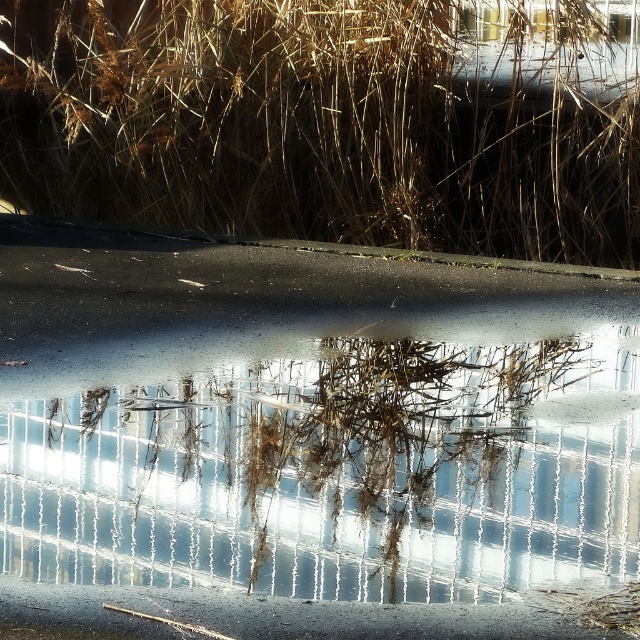
Question: Among these objects, which one is farthest from the camera?

Choices:
 (A) brown grass at upper center
 (B) clear glass puddle at center

Answer: (A)

Question: Is clear glass puddle at center to the left of brown grass at upper center from the viewer's perspective?

Choices:
 (A) yes
 (B) no

Answer: (A)

Question: Is clear glass puddle at center further to camera compared to brown grass at upper center?

Choices:
 (A) no
 (B) yes

Answer: (A)

Question: Is clear glass puddle at center to the left of brown grass at upper center from the viewer's perspective?

Choices:
 (A) yes
 (B) no

Answer: (A)

Question: Which point is closer to the camera?

Choices:
 (A) clear glass puddle at center
 (B) brown grass at upper center

Answer: (A)